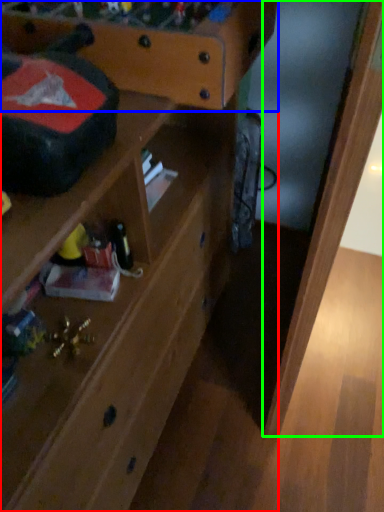
Question: Based on their relative distances, which object is nearer to shelf (highlighted by a red box)? Choose from writing desk (highlighted by a blue box) and wood (highlighted by a green box).

Choices:
 (A) writing desk
 (B) wood

Answer: (A)